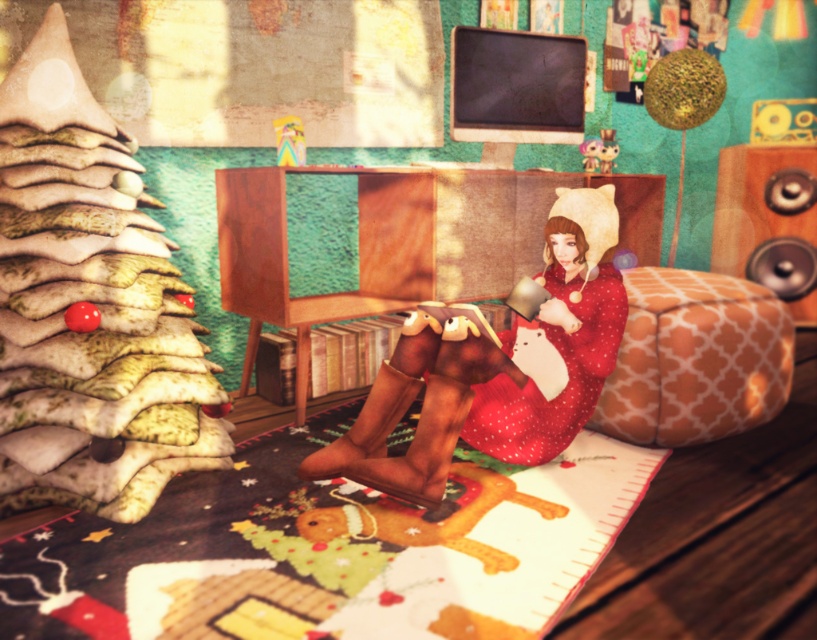
Who is taller, matte red dress at center or red dotted fabric dress at center?

With more height is matte red dress at center.

This screenshot has width=817, height=640. What do you see at coordinates (494, 368) in the screenshot?
I see `matte red dress at center` at bounding box center [494, 368].

Which is behind, point (489, 417) or point (579, 426)?

Point (579, 426)

Locate an element on the screen. The image size is (817, 640). matte red dress at center is located at coordinates (494, 368).

Between matte red dress at center and metallic silver speaker at right, which one is positioned higher?

metallic silver speaker at right

Does matte red dress at center appear under metallic silver speaker at right?

Correct, matte red dress at center is located below metallic silver speaker at right.

Find the location of a particular element. This screenshot has height=640, width=817. matte red dress at center is located at coordinates (494, 368).

Can you confirm if red dotted fabric dress at center is positioned below metallic silver speaker at right?

Yes.

Who is shorter, red dotted fabric dress at center or metallic silver speaker at right?

With less height is red dotted fabric dress at center.

The width and height of the screenshot is (817, 640). What do you see at coordinates (567, 381) in the screenshot? I see `red dotted fabric dress at center` at bounding box center [567, 381].

The height and width of the screenshot is (640, 817). What are the coordinates of `red dotted fabric dress at center` in the screenshot? It's located at (567, 381).